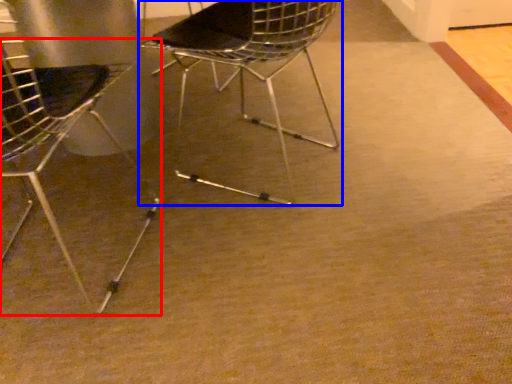
Question: Among these objects, which one is nearest to the camera, chair (highlighted by a red box) or chair (highlighted by a blue box)?

Choices:
 (A) chair
 (B) chair

Answer: (A)